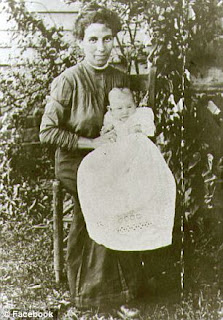
Identify the location of chair. click(60, 218).